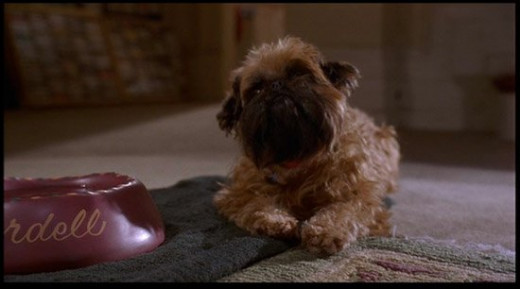
At what (x,y) coordinates should I click in order to perform the action: click on carpet. Please return your answer as a coordinate pair (x, y). Image resolution: width=520 pixels, height=289 pixels. Looking at the image, I should click on (448, 192).